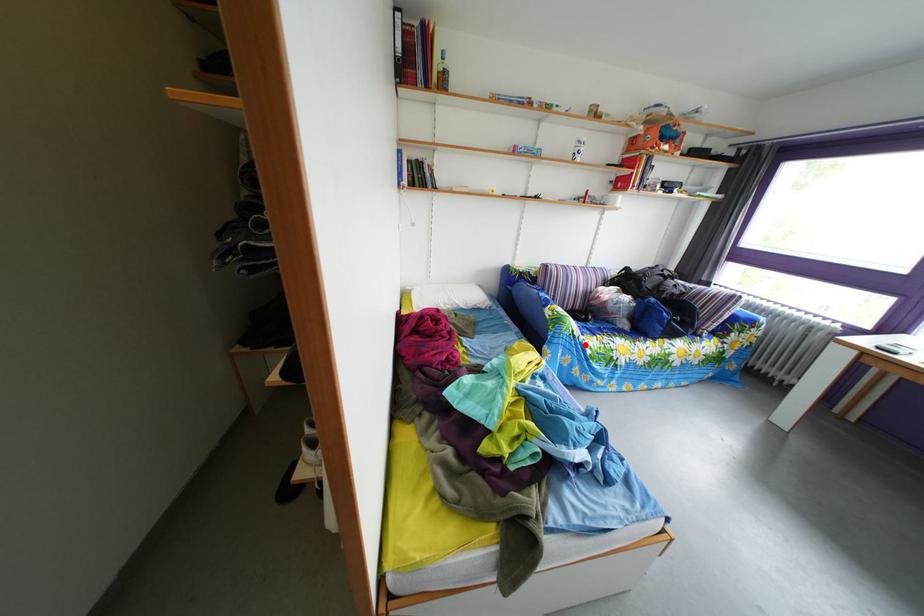
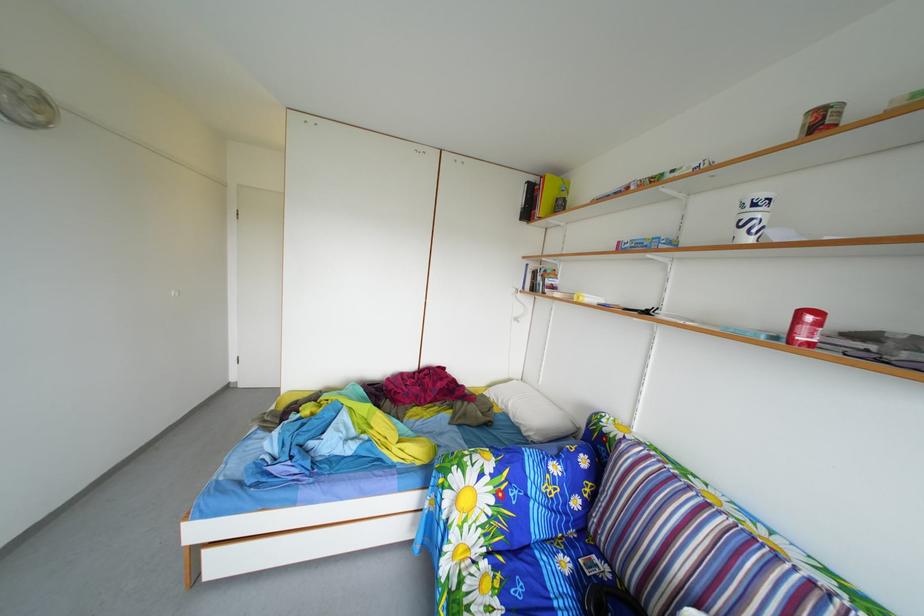
Find the pixel in the second image that matches the highlighted location in the first image.

(453, 507)